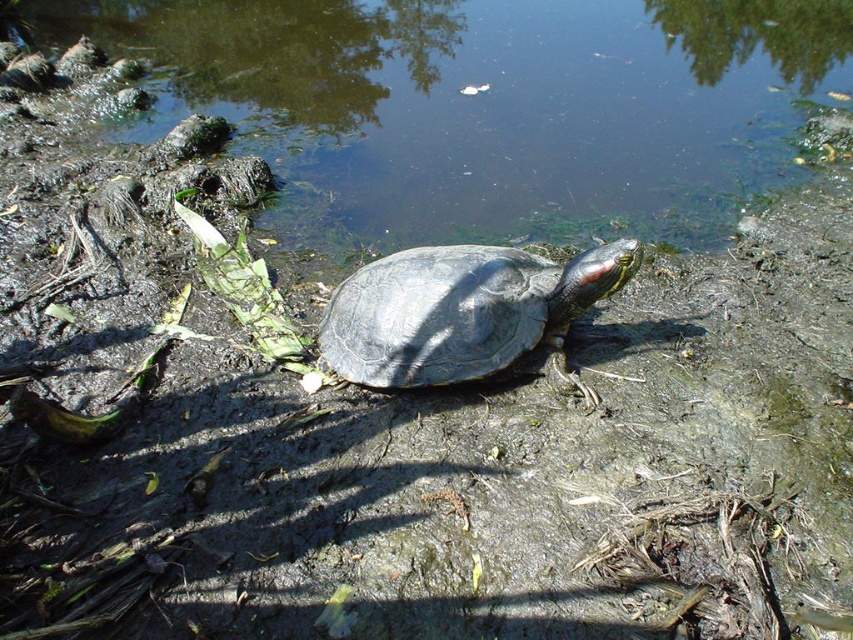
You are a wildlife photographer aiming to capture a clear photo of the shiny dark gray tortoise at center without the greenish murky water at center appearing in the background. Given that your camera has a depth of field that can focus on objects within a 2 meter range, can you achieve this?

The greenish murky water at center is 2.14 meters away from the shiny dark gray tortoise at center. Since the distance between them exceeds the camera lens depth of field range of 2 meters, you can focus on the shiny dark gray tortoise at center while blurring the greenish murky water at center in the background.

You are a wildlife photographer aiming to capture the shiny dark gray tortoise at center and the greenish murky water at center in a single frame. Based on their positions, will the tortoise be fully visible above the water in your photo?

The greenish murky water at center is taller than shiny dark gray tortoise at center, so the tortoise will not be fully visible above the water in the photo.

You are a drone operator trying to capture a closeup of the turtle on the bank. The turtle is located at position 0.333, 0.741. To avoid disturbing the turtle, you need to position your drone so that it hovers directly above the greenish murky water at center. What are the coordinates you should input into your drone control system?

The coordinates for the greenish murky water at center are [486,106], so you should input those coordinates into your drone control system to position it directly above the greenish murky water at center.